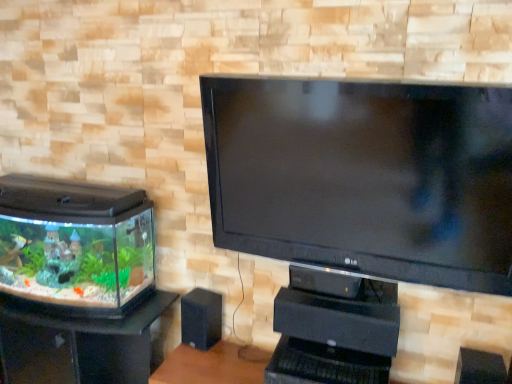
Question: Is point (4, 332) closer or farther from the camera than point (205, 344)?

Choices:
 (A) farther
 (B) closer

Answer: (B)

Question: From a real-world perspective, is clear glass aquarium at left positioned above or below black matte speaker at lower center?

Choices:
 (A) above
 (B) below

Answer: (B)

Question: Looking at the image, does clear glass aquarium at left seem bigger or smaller compared to black matte speaker at lower center?

Choices:
 (A) big
 (B) small

Answer: (A)

Question: Considering their positions, is black matte speaker at lower center located in front of or behind clear glass aquarium at left?

Choices:
 (A) front
 (B) behind

Answer: (B)

Question: From the image's perspective, is black matte speaker at lower center above or below clear glass aquarium at left?

Choices:
 (A) below
 (B) above

Answer: (B)

Question: Is black matte speaker at lower center bigger or smaller than clear glass aquarium at left?

Choices:
 (A) big
 (B) small

Answer: (B)

Question: Would you say black matte speaker at lower center is inside or outside clear glass aquarium at left?

Choices:
 (A) outside
 (B) inside

Answer: (A)